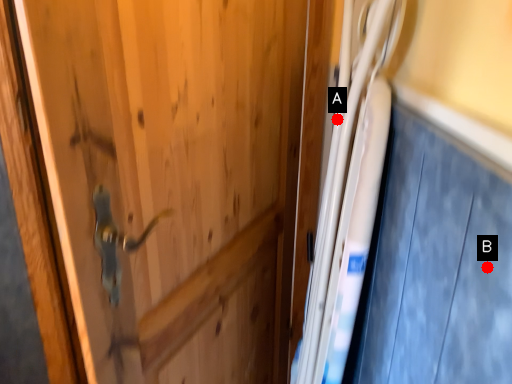
Question: Two points are circled on the image, labeled by A and B beside each circle. Which point appears closest to the camera in this image?

Choices:
 (A) A is closer
 (B) B is closer

Answer: (B)